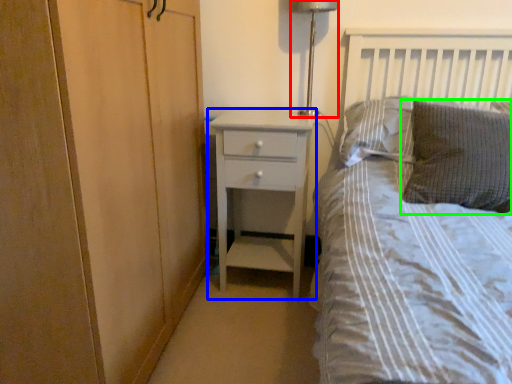
Question: Estimate the real-world distances between objects in this image. Which object is farther from bedside lamp (highlighted by a red box), chest of drawers (highlighted by a blue box) or pillow (highlighted by a green box)?

Choices:
 (A) chest of drawers
 (B) pillow

Answer: (B)